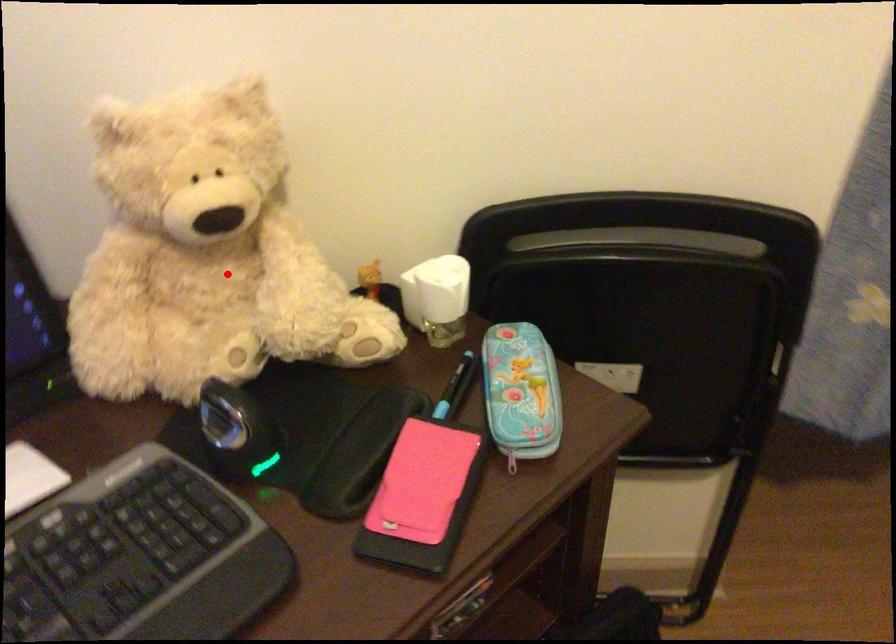
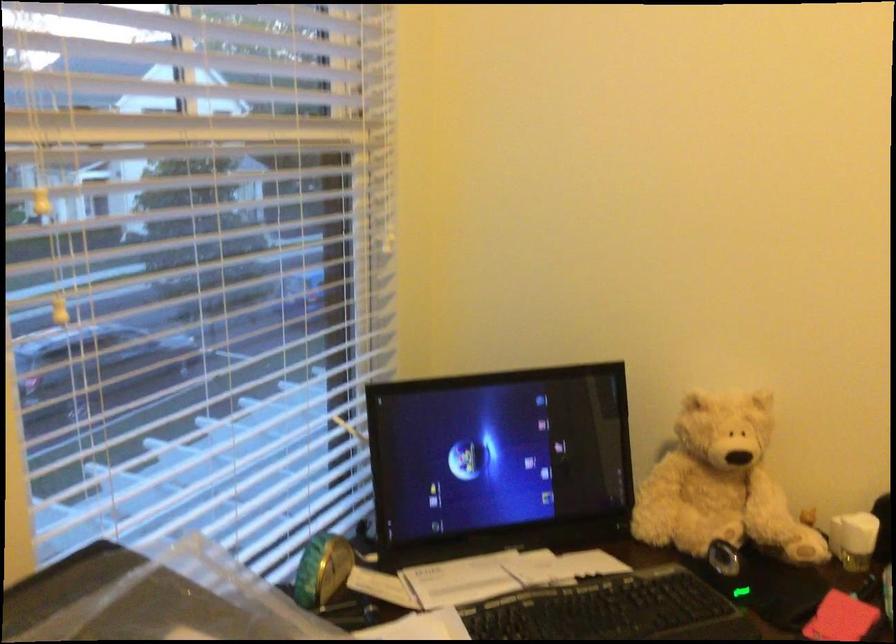
Question: A red point is marked in image1. In image2, is the corresponding 3D point closer to the camera or farther? Reply with the corresponding letter.

Choices:
 (A) The corresponding 3D point is closer.
 (B) The corresponding 3D point is farther.

Answer: (B)